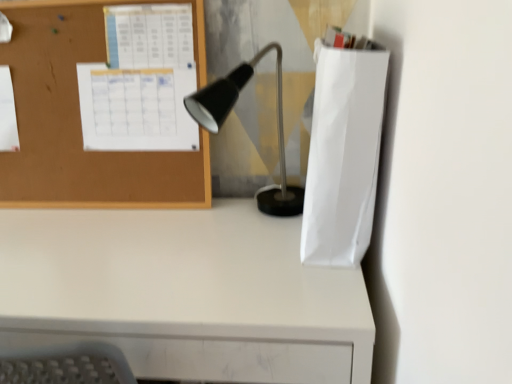
Question: In terms of height, does matte black lamp at center look taller or shorter compared to white matte paper bag at right?

Choices:
 (A) tall
 (B) short

Answer: (B)

Question: Considering their positions, is matte black lamp at center located in front of or behind white matte paper bag at right?

Choices:
 (A) behind
 (B) front

Answer: (A)

Question: Which object is positioned farthest from the white matte desk at lower left?

Choices:
 (A) white matte paper bag at right
 (B) matte black lamp at center
 (C) corkboard at upper left

Answer: (B)

Question: Estimate the real-world distances between objects in this image. Which object is farther from the matte black lamp at center?

Choices:
 (A) white matte paper bag at right
 (B) corkboard at upper left
 (C) white matte desk at lower left

Answer: (C)